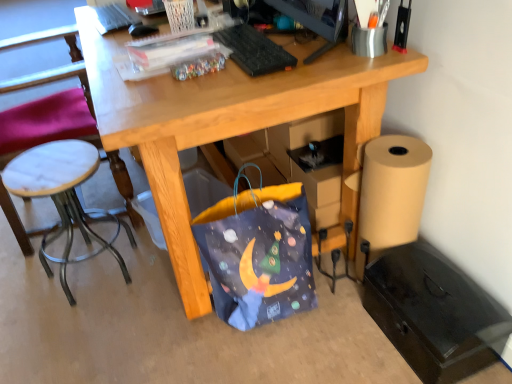
Image resolution: width=512 pixels, height=384 pixels. I want to click on free space above white marble stool at left (from a real-world perspective), so click(x=55, y=167).